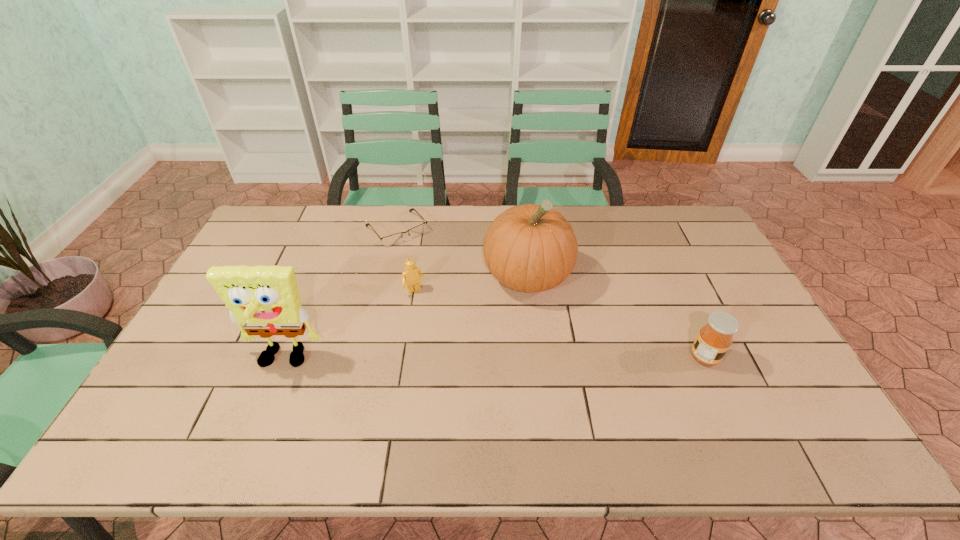
At what (x,y) coordinates should I click in order to perform the action: click on free space between the Lego and the pumpkin. Please return your answer as a coordinate pair (x, y). Image resolution: width=960 pixels, height=540 pixels. Looking at the image, I should click on (471, 284).

The height and width of the screenshot is (540, 960). In order to click on free spot between the second object from right to left and the fourth tallest object in this screenshot , I will do `click(471, 284)`.

Image resolution: width=960 pixels, height=540 pixels. Find the location of `vacant space in between the rightmost object and the leftmost object`. vacant space in between the rightmost object and the leftmost object is located at coordinates (493, 359).

Choose which object is the nearest neighbor to the second shortest object. Please provide its 2D coordinates. Your answer should be formatted as a tuple, i.e. [(x, y)], where the tuple contains the x and y coordinates of a point satisfying the conditions above.

[(530, 248)]

Identify which object is located as the third nearest to the second object from right to left. Please provide its 2D coordinates. Your answer should be formatted as a tuple, i.e. [(x, y)], where the tuple contains the x and y coordinates of a point satisfying the conditions above.

[(714, 339)]

Where is `vacant space that satisfies the following two spatial constraints: 1. on the front side of the spectacles; 2. on the left side of the fourth object from left to right`? The height and width of the screenshot is (540, 960). vacant space that satisfies the following two spatial constraints: 1. on the front side of the spectacles; 2. on the left side of the fourth object from left to right is located at coordinates (386, 276).

In order to click on free spot that satisfies the following two spatial constraints: 1. on the front side of the third tallest object; 2. on the front-facing side of the fourth tallest object in this screenshot , I will do point(405,357).